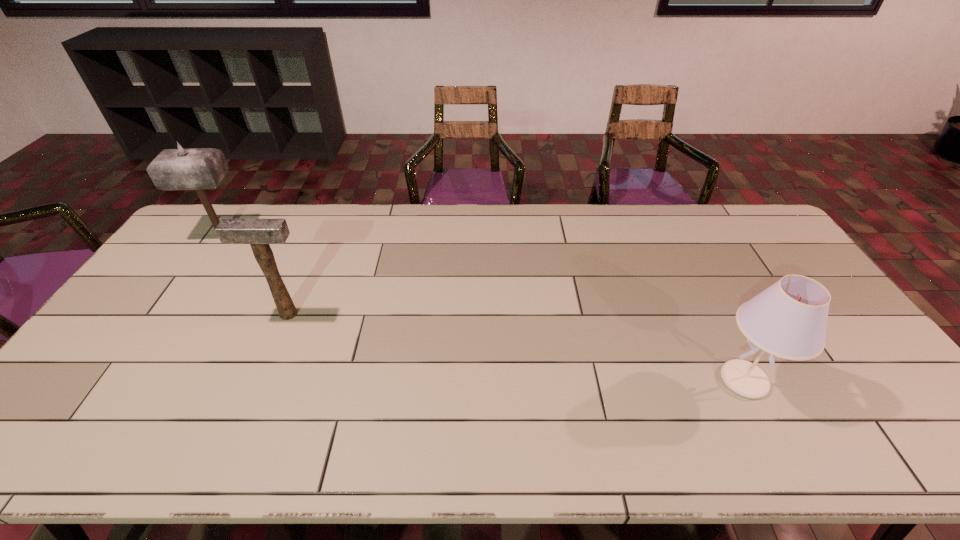
Where is `free spot that satisfies the following two spatial constraints: 1. on the front side of the farther mallet; 2. on the left side of the second object from right to left`? Image resolution: width=960 pixels, height=540 pixels. free spot that satisfies the following two spatial constraints: 1. on the front side of the farther mallet; 2. on the left side of the second object from right to left is located at coordinates (169, 314).

Find the location of a particular element. vacant space that satisfies the following two spatial constraints: 1. on the front side of the rightmost object; 2. on the right side of the second nearest object is located at coordinates (260, 380).